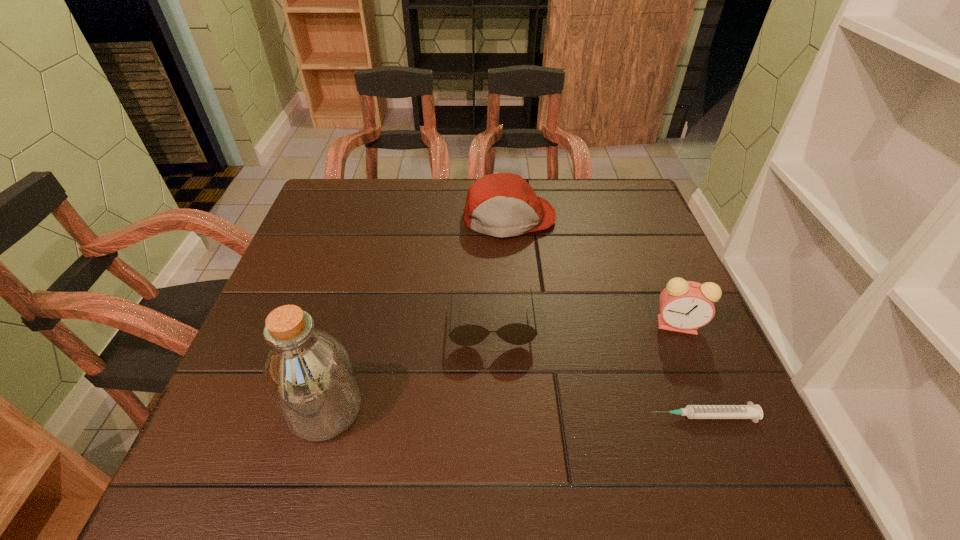
At what (x,y) coordinates should I click in order to perform the action: click on bottle at the near edge. Please return your answer as a coordinate pair (x, y). This screenshot has height=540, width=960. Looking at the image, I should click on (308, 375).

This screenshot has height=540, width=960. I want to click on syringe present at the near edge, so click(x=750, y=411).

Locate an element on the screen. This screenshot has width=960, height=540. object at the left edge is located at coordinates (308, 375).

Where is `syringe that is at the right edge`? This screenshot has height=540, width=960. syringe that is at the right edge is located at coordinates (750, 411).

Identify the location of alarm clock located in the right edge section of the desktop. (685, 306).

Where is `object that is at the near left corner`? This screenshot has height=540, width=960. object that is at the near left corner is located at coordinates (308, 375).

Where is `object that is at the near right corner`? The height and width of the screenshot is (540, 960). object that is at the near right corner is located at coordinates (750, 411).

Identify the location of free space at the far edge of the desktop. The width and height of the screenshot is (960, 540). (415, 222).

Locate an element on the screen. This screenshot has width=960, height=540. free location at the left edge is located at coordinates tap(328, 327).

The width and height of the screenshot is (960, 540). Find the location of `free space at the right edge`. free space at the right edge is located at coordinates (660, 260).